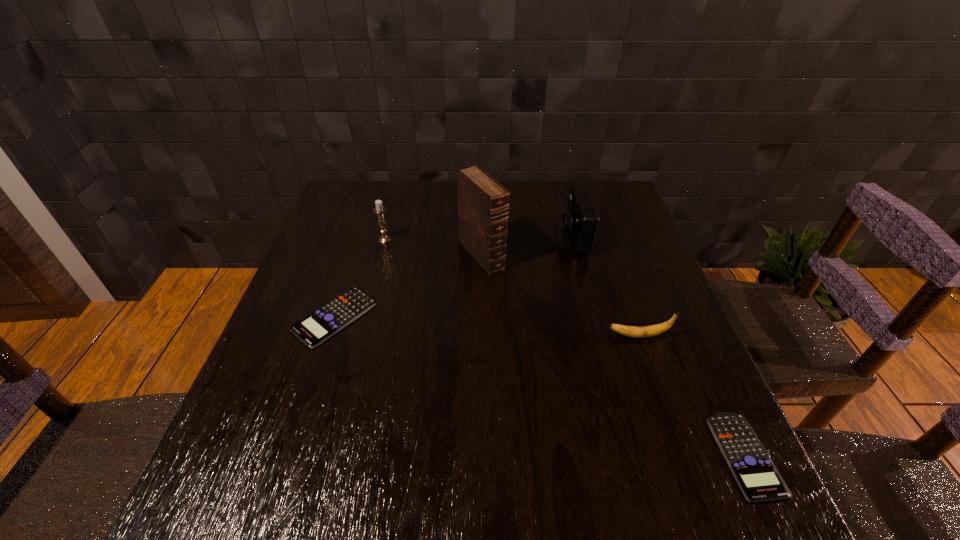
You are a GUI agent. You are given a task and a screenshot of the screen. Output one action in this format:
    pyautogui.click(x=<x>, y=<y>)
    Task: Click on the vacant space situated on the left of the nearer calculator
    
    Given the screenshot: What is the action you would take?
    coord(572,455)

You are a GUI agent. You are given a task and a screenshot of the screen. Output one action in this format:
    pyautogui.click(x=<x>, y=<y>)
    Task: Click on the free spot located 0.350m on the front-facing side of the camera
    The image size is (960, 540).
    Given the screenshot: What is the action you would take?
    pyautogui.click(x=436, y=237)

Where is `free region located on the front-facing side of the camera`? free region located on the front-facing side of the camera is located at coordinates (499, 237).

The height and width of the screenshot is (540, 960). I want to click on vacant area situated 0.160m on the front-facing side of the camera, so click(x=503, y=237).

Where is `free region located on the right of the candle holder`? free region located on the right of the candle holder is located at coordinates (472, 240).

The width and height of the screenshot is (960, 540). I want to click on blank space located 0.070m on the left of the tallest object, so coord(432,255).

At what (x,y) coordinates should I click in order to perform the action: click on free location located 0.350m on the peel of the banana from the top. Please return your answer as a coordinate pair (x, y). Looking at the image, I should click on (449, 336).

You are a GUI agent. You are given a task and a screenshot of the screen. Output one action in this format:
    pyautogui.click(x=<x>, y=<y>)
    Task: Click on the vacant region located on the peel of the banana from the top
    The image size is (960, 540).
    Given the screenshot: What is the action you would take?
    pyautogui.click(x=472, y=336)

This screenshot has height=540, width=960. In order to click on vacant area located on the peel of the banana from the top in this screenshot , I will do `click(445, 336)`.

The image size is (960, 540). I want to click on object that is at the far edge, so click(x=581, y=220).